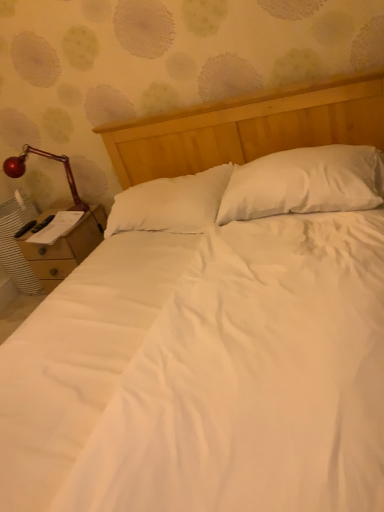
Question: Is shiny red lamp at left facing towards wooden nightstand at left?

Choices:
 (A) yes
 (B) no

Answer: (B)

Question: Does shiny red lamp at left have a lesser height compared to wooden nightstand at left?

Choices:
 (A) yes
 (B) no

Answer: (A)

Question: Is shiny red lamp at left far from wooden nightstand at left?

Choices:
 (A) no
 (B) yes

Answer: (A)

Question: Is shiny red lamp at left turned away from wooden nightstand at left?

Choices:
 (A) no
 (B) yes

Answer: (A)

Question: From a real-world perspective, is shiny red lamp at left physically above wooden nightstand at left?

Choices:
 (A) yes
 (B) no

Answer: (A)

Question: Can you confirm if shiny red lamp at left is smaller than wooden nightstand at left?

Choices:
 (A) no
 (B) yes

Answer: (B)

Question: Considering the relative sizes of white soft pillow at center, the second pillow in the right-to-left sequence, and wooden nightstand at left in the image provided, is white soft pillow at center, the second pillow in the right-to-left sequence, thinner than wooden nightstand at left?

Choices:
 (A) yes
 (B) no

Answer: (B)

Question: Are white soft pillow at center, the second pillow in the right-to-left sequence, and wooden nightstand at left located far from each other?

Choices:
 (A) yes
 (B) no

Answer: (B)

Question: From the image's perspective, is white soft pillow at center, the first pillow in the left-to-right sequence, beneath wooden nightstand at left?

Choices:
 (A) yes
 (B) no

Answer: (B)

Question: From a real-world perspective, is white soft pillow at center, the first pillow in the left-to-right sequence, over wooden nightstand at left?

Choices:
 (A) no
 (B) yes

Answer: (B)

Question: Does white soft pillow at center, the first pillow in the left-to-right sequence, have a larger size compared to wooden nightstand at left?

Choices:
 (A) yes
 (B) no

Answer: (B)

Question: From a real-world perspective, is white soft pillow at center, the first pillow in the left-to-right sequence, under wooden nightstand at left?

Choices:
 (A) yes
 (B) no

Answer: (B)

Question: From a real-world perspective, is wooden nightstand at left on white soft pillow at center, the first pillow in the left-to-right sequence?

Choices:
 (A) no
 (B) yes

Answer: (A)